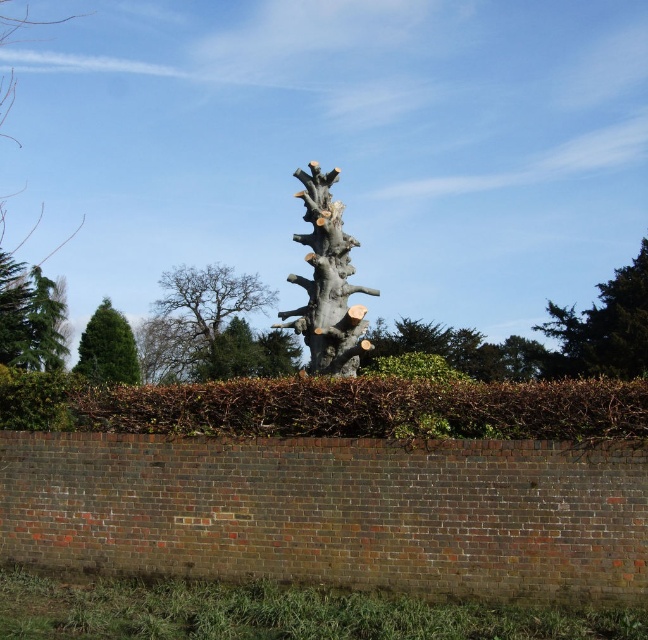
Question: Estimate the real-world distances between objects in this image. Which object is farther from the smooth gray tree trunk at center?

Choices:
 (A) green textured tree at upper right
 (B) green matte evergreen tree at lower left

Answer: (B)

Question: Is green textured tree at upper right bigger than green matte evergreen tree at lower left?

Choices:
 (A) yes
 (B) no

Answer: (A)

Question: Can you confirm if smooth gray tree trunk at center is positioned to the right of green textured tree at upper right?

Choices:
 (A) no
 (B) yes

Answer: (A)

Question: Which object is closer to the camera taking this photo?

Choices:
 (A) green matte evergreen tree at lower left
 (B) smooth gray tree trunk at upper center

Answer: (A)

Question: Based on their relative distances, which object is farther from the smooth gray tree trunk at center?

Choices:
 (A) green textured tree at upper right
 (B) smooth gray tree trunk at upper center
 (C) green matte evergreen tree at lower left
 (D) green needle-like leaves at left

Answer: (B)

Question: Can you confirm if smooth gray tree trunk at center is thinner than green matte evergreen tree at lower left?

Choices:
 (A) yes
 (B) no

Answer: (A)